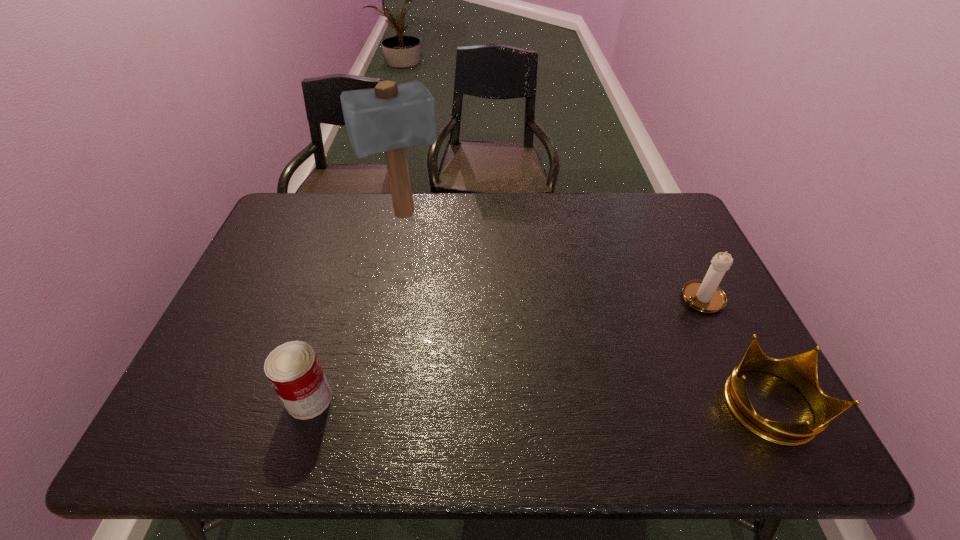
Find the location of a particular element. The width and height of the screenshot is (960, 540). object situated at the near right corner is located at coordinates (800, 370).

Locate an element on the screen. This screenshot has height=540, width=960. free space at the far edge of the desktop is located at coordinates (396, 226).

Identify the location of vacant space at the near edge of the desktop. (489, 407).

Where is `free space at the left edge`? This screenshot has width=960, height=540. free space at the left edge is located at coordinates (199, 370).

This screenshot has height=540, width=960. I want to click on vacant space at the right edge, so click(703, 254).

Locate an element on the screen. This screenshot has width=960, height=540. vacant space at the far right corner of the desktop is located at coordinates (689, 234).

The width and height of the screenshot is (960, 540). I want to click on free space between the farthest object and the can, so click(356, 307).

The image size is (960, 540). I want to click on empty location between the shortest object and the farthest object, so click(x=586, y=310).

Where is `free spot between the farthest object and the candle holder`? The height and width of the screenshot is (540, 960). free spot between the farthest object and the candle holder is located at coordinates [552, 257].

You are a GUI agent. You are given a task and a screenshot of the screen. Output one action in this format:
    pyautogui.click(x=<x>, y=<y>)
    Task: Click on the free spot between the candle holder and the shortest object
    The height and width of the screenshot is (540, 960).
    Given the screenshot: What is the action you would take?
    pyautogui.click(x=733, y=352)